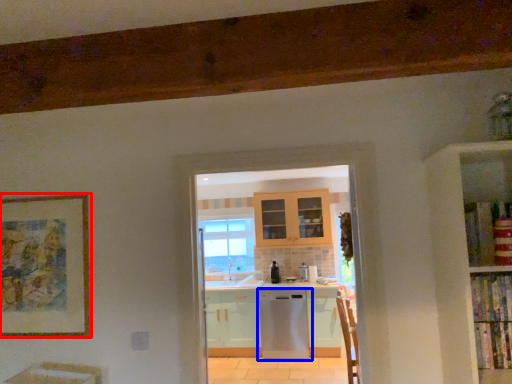
Question: Among these objects, which one is farthest to the camera, picture frame (highlighted by a red box) or home appliance (highlighted by a blue box)?

Choices:
 (A) picture frame
 (B) home appliance

Answer: (B)